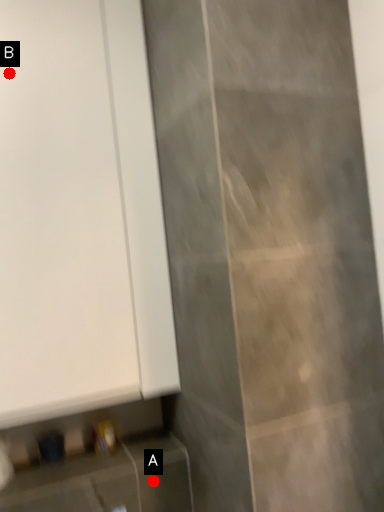
Question: Two points are circled on the image, labeled by A and B beside each circle. Which point is closer to the camera?

Choices:
 (A) A is closer
 (B) B is closer

Answer: (B)